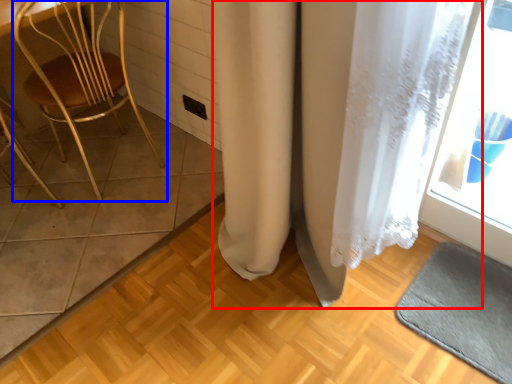
Question: Which object is further to the camera taking this photo, curtain (highlighted by a red box) or chair (highlighted by a blue box)?

Choices:
 (A) curtain
 (B) chair

Answer: (B)